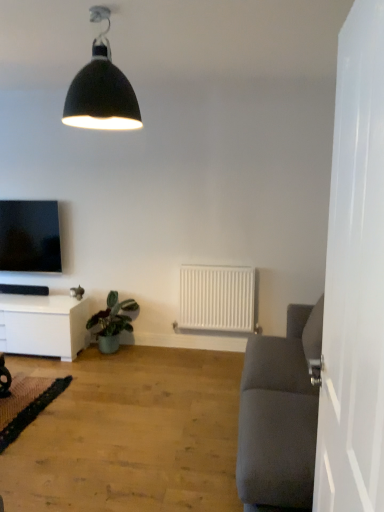
Question: Is green textured mat at lower left to the right of matte black tv at left from the viewer's perspective?

Choices:
 (A) no
 (B) yes

Answer: (B)

Question: Is green textured mat at lower left at the left side of matte black tv at left?

Choices:
 (A) no
 (B) yes

Answer: (A)

Question: Considering the relative sizes of green textured mat at lower left and matte black tv at left in the image provided, is green textured mat at lower left thinner than matte black tv at left?

Choices:
 (A) no
 (B) yes

Answer: (A)

Question: Considering the relative sizes of green textured mat at lower left and matte black tv at left in the image provided, is green textured mat at lower left bigger than matte black tv at left?

Choices:
 (A) yes
 (B) no

Answer: (B)

Question: From the image's perspective, is green textured mat at lower left located beneath matte black tv at left?

Choices:
 (A) no
 (B) yes

Answer: (B)

Question: From the image's perspective, is white matte radiator at center located above or below black matte lampshade at upper center?

Choices:
 (A) above
 (B) below

Answer: (B)

Question: Visually, is white matte radiator at center positioned to the left or to the right of black matte lampshade at upper center?

Choices:
 (A) left
 (B) right

Answer: (B)

Question: Considering the positions of white matte radiator at center and black matte lampshade at upper center in the image, is white matte radiator at center wider or thinner than black matte lampshade at upper center?

Choices:
 (A) thin
 (B) wide

Answer: (A)

Question: From a real-world perspective, is white matte radiator at center positioned above or below black matte lampshade at upper center?

Choices:
 (A) below
 (B) above

Answer: (A)

Question: Looking at their shapes, would you say white glossy door at right is wider or thinner than green textured mat at lower left?

Choices:
 (A) wide
 (B) thin

Answer: (B)

Question: From the image's perspective, is white glossy door at right located above or below green textured mat at lower left?

Choices:
 (A) below
 (B) above

Answer: (B)

Question: In terms of height, does white glossy door at right look taller or shorter compared to green textured mat at lower left?

Choices:
 (A) tall
 (B) short

Answer: (A)

Question: Looking at the image, does white glossy door at right seem bigger or smaller compared to green textured mat at lower left?

Choices:
 (A) big
 (B) small

Answer: (A)

Question: Is black matte lampshade at upper center in front of or behind green matte plant at lower left in the image?

Choices:
 (A) behind
 (B) front

Answer: (B)

Question: In terms of width, does black matte lampshade at upper center look wider or thinner when compared to green matte plant at lower left?

Choices:
 (A) thin
 (B) wide

Answer: (A)